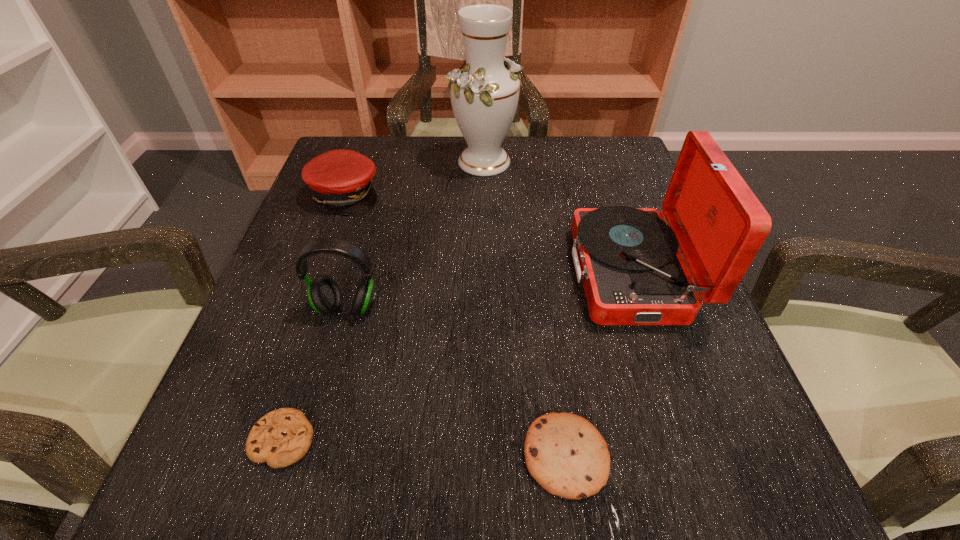
At what (x,y) coordinates should I click in order to perform the action: click on free region located on the front-facing side of the fifth shortest object. Please return your answer as a coordinate pair (x, y). Looking at the image, I should click on (526, 274).

I want to click on free region located 0.240m on the front-facing side of the fifth shortest object, so [x=446, y=274].

Image resolution: width=960 pixels, height=540 pixels. What are the coordinates of `free point located 0.060m on the front-facing side of the fifth shortest object` in the screenshot? It's located at (542, 274).

Locate an element on the screen. This screenshot has height=540, width=960. vacant space situated on the ear cups of the fourth shortest object is located at coordinates (310, 445).

What are the coordinates of `vacant position located 0.390m on the front-facing side of the fourth tallest object` in the screenshot? It's located at (549, 194).

Image resolution: width=960 pixels, height=540 pixels. I want to click on vacant point located on the left of the right cookie, so click(308, 456).

Where is `free region located 0.120m on the back of the shorter cookie`? free region located 0.120m on the back of the shorter cookie is located at coordinates (314, 343).

You are a GUI agent. You are given a task and a screenshot of the screen. Output one action in this format:
    pyautogui.click(x=<x>, y=<y>)
    Task: Click on the vase situated at the far edge
    The image size is (960, 540).
    Given the screenshot: What is the action you would take?
    pyautogui.click(x=484, y=95)

Locate an element on the screen. Image resolution: width=960 pixels, height=540 pixels. cap present at the far edge is located at coordinates (341, 180).

This screenshot has width=960, height=540. Identify the location of headset present at the left edge. (324, 295).